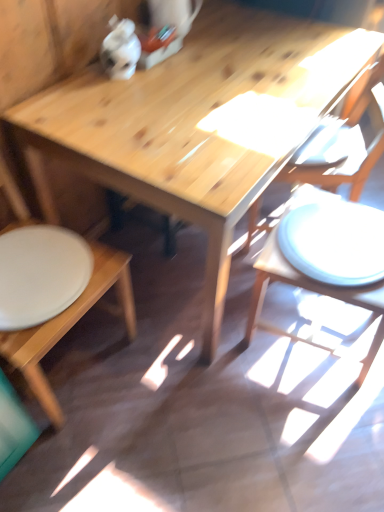
Where is `free space in front of wooden table at center`? The height and width of the screenshot is (512, 384). free space in front of wooden table at center is located at coordinates (213, 423).